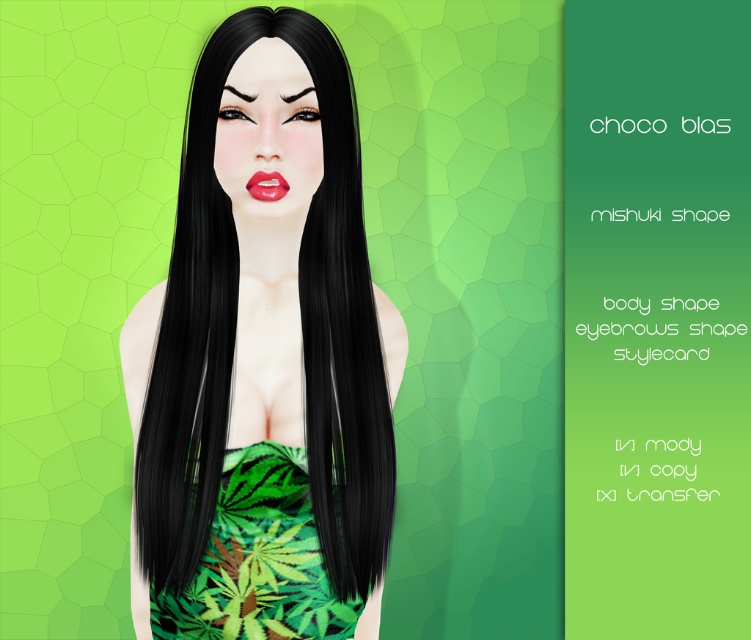
You are a fashion designer trying to create a new outfit for the character. You need to ensure there is enough space between the shiny black hair at center and the green leafy fabric dress at center to add a necklace. Given that the necklace requires 5 inches of space, can you fit it between them?

The shiny black hair at center and green leafy fabric dress at center are 4.51 inches apart from each other. Since the required space for the necklace is 5 inches, the distance is insufficient. The necklace cannot be added between them.

Based on the scene description, can you determine the relative position of the shiny black hair at center and the green leafy fabric dress at center?

The shiny black hair at center is positioned to the left of the green leafy fabric dress at center.